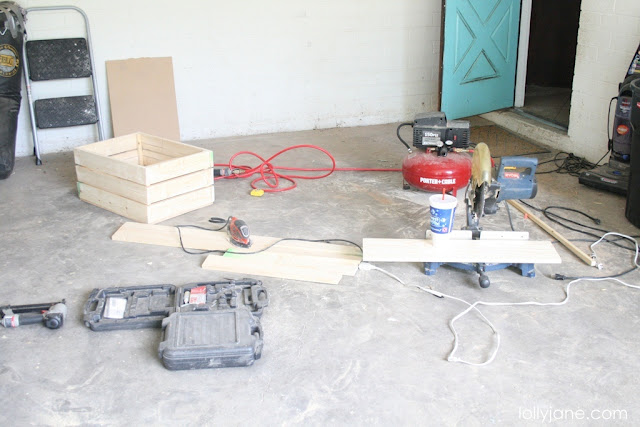
This screenshot has height=427, width=640. I want to click on door, so click(x=470, y=51).